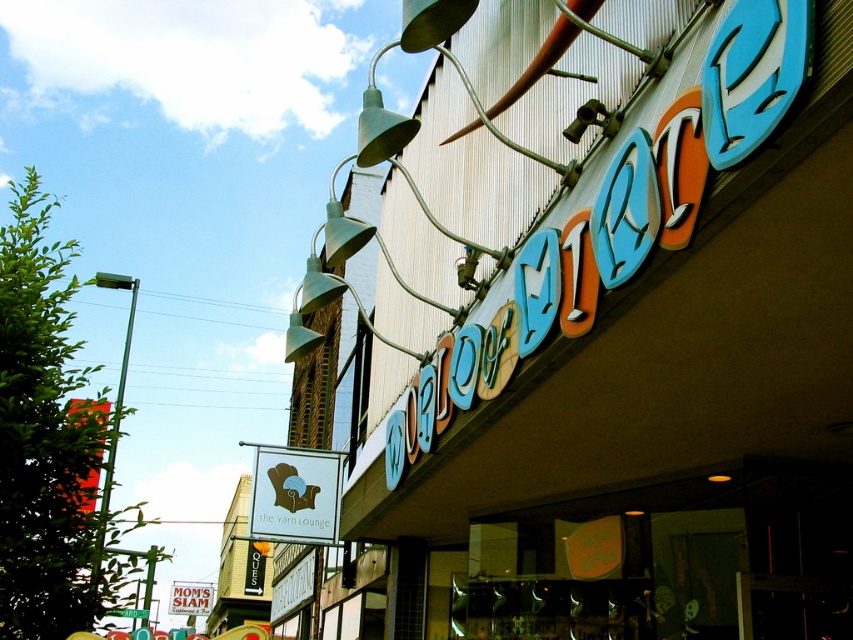
You are standing in front of the building and want to take a photo of the two points marked on the building. Which point, point (x=815, y=556) or point (x=183, y=596), will appear larger in your photo?

Point (x=815, y=556) is closer to the camera than point (x=183, y=596), so it will appear larger in the photo.